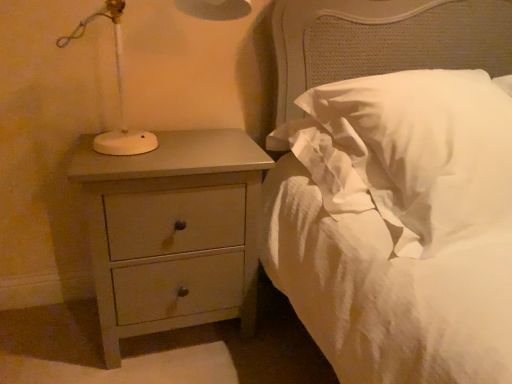
Question: From the image's perspective, is white soft pillow at upper right beneath matte gray chest of drawers at left?

Choices:
 (A) yes
 (B) no

Answer: (B)

Question: From a real-world perspective, is white soft pillow at upper right on matte gray chest of drawers at left?

Choices:
 (A) no
 (B) yes

Answer: (B)

Question: Considering the relative sizes of white soft pillow at upper right and matte gray chest of drawers at left in the image provided, is white soft pillow at upper right bigger than matte gray chest of drawers at left?

Choices:
 (A) yes
 (B) no

Answer: (A)

Question: Is white soft pillow at upper right positioned far away from matte gray chest of drawers at left?

Choices:
 (A) yes
 (B) no

Answer: (B)

Question: Is white soft pillow at upper right surrounding matte gray chest of drawers at left?

Choices:
 (A) yes
 (B) no

Answer: (B)

Question: Can you confirm if white soft pillow at upper right is smaller than matte gray chest of drawers at left?

Choices:
 (A) yes
 (B) no

Answer: (B)

Question: Is white soft pillow at upper right completely or partially inside matte gray chest of drawers at left?

Choices:
 (A) yes
 (B) no

Answer: (B)

Question: From the image's perspective, is matte gray chest of drawers at left located above white soft pillow at upper right?

Choices:
 (A) no
 (B) yes

Answer: (A)

Question: From a real-world perspective, is matte gray chest of drawers at left positioned over white soft pillow at upper right based on gravity?

Choices:
 (A) yes
 (B) no

Answer: (B)

Question: Does matte gray chest of drawers at left have a larger size compared to white soft pillow at upper right?

Choices:
 (A) no
 (B) yes

Answer: (A)

Question: Is matte gray chest of drawers at left smaller than white soft pillow at upper right?

Choices:
 (A) no
 (B) yes

Answer: (B)

Question: Is matte gray chest of drawers at left taller than white soft pillow at upper right?

Choices:
 (A) no
 (B) yes

Answer: (B)

Question: Does point (150, 210) appear closer or farther from the camera than point (499, 130)?

Choices:
 (A) closer
 (B) farther

Answer: (B)